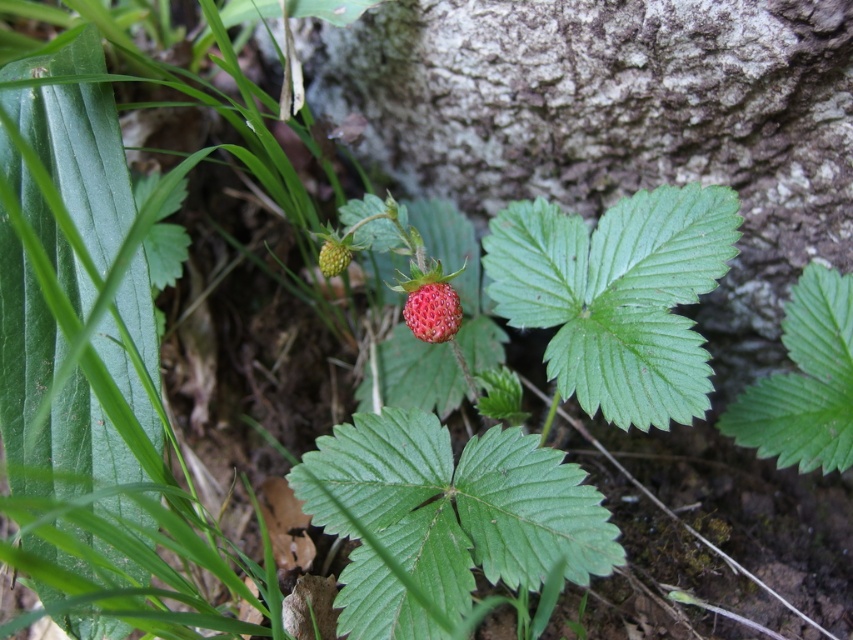
Does glossy red strawberry at center appear under green matte strawberry at center?

Correct, glossy red strawberry at center is located below green matte strawberry at center.

Does glossy red strawberry at center have a lesser height compared to green matte strawberry at center?

No.

Where is `glossy red strawberry at center`? glossy red strawberry at center is located at coordinates 432,310.

Where is `glossy red strawberry at center`? The height and width of the screenshot is (640, 853). glossy red strawberry at center is located at coordinates (432, 310).